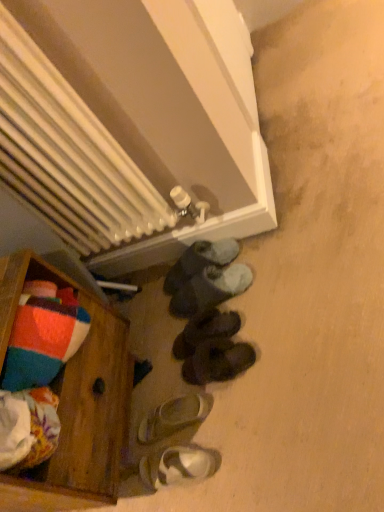
The image size is (384, 512). I want to click on vacant space behind black suede slippers at center, which is counted as the third footwear, starting from the top, so click(158, 317).